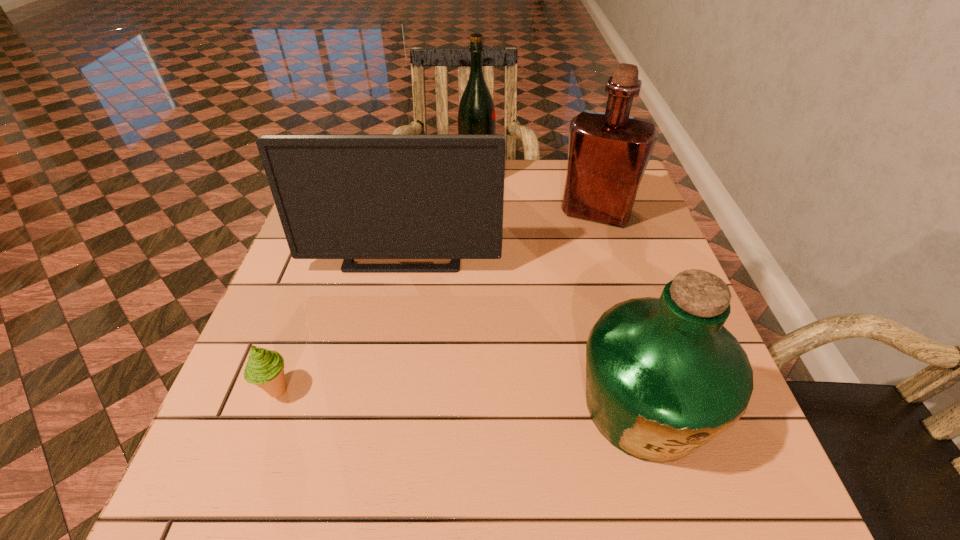
Locate which liquor ranks in proximity to the second farthest liquor. Please provide its 2D coordinates. Your answer should be formatted as a tuple, i.e. [(x, y)], where the tuple contains the x and y coordinates of a point satisfying the conditions above.

[(476, 115)]

At what (x,y) coordinates should I click in order to perform the action: click on vacant space that satisfies the following two spatial constraints: 1. on the front-facing side of the second farthest liquor; 2. on the left side of the leftmost liquor. Please return your answer as a coordinate pair (x, y). This screenshot has height=540, width=960. Looking at the image, I should click on (477, 212).

What are the coordinates of `free space that satisfies the following two spatial constraints: 1. on the front-facing side of the second nearest liquor; 2. on the right side of the farthest object` in the screenshot? It's located at (477, 212).

Image resolution: width=960 pixels, height=540 pixels. In order to click on vacant region that satisfies the following two spatial constraints: 1. on the front-facing side of the farthest liquor; 2. on the screen side of the computer monitor in this screenshot , I will do `click(476, 251)`.